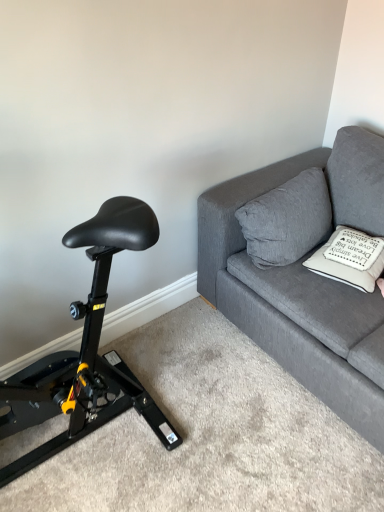
Describe the element at coordinates (349, 262) in the screenshot. I see `white soft cushion at upper right, which is counted as the second pillow, starting from the left` at that location.

Find the location of a particular element. The image size is (384, 512). white soft cushion at upper right, marked as the first pillow in a right-to-left arrangement is located at coordinates (349, 262).

Image resolution: width=384 pixels, height=512 pixels. What are the coordinates of `gray fabric pillow at upper right, which is the first pillow from left to right` in the screenshot? It's located at [x=287, y=220].

You are a GUI agent. You are given a task and a screenshot of the screen. Output one action in this format:
    pyautogui.click(x=<x>, y=<y>)
    Task: Click on the white soft cushion at upper right, marked as the first pillow in a right-to-left arrangement
    
    Given the screenshot: What is the action you would take?
    pyautogui.click(x=349, y=262)

From the image's perspective, is black leather saddle at left above white soft cushion at upper right, which is counted as the second pillow, starting from the left?

No, from the image's perspective, black leather saddle at left is not over white soft cushion at upper right, which is counted as the second pillow, starting from the left.

From a real-world perspective, which pillow is the 2nd one underneath the black leather saddle at left? Please provide its 2D coordinates.

[(349, 262)]

From the picture: How different are the orientations of black leather saddle at left and white soft cushion at upper right, which is counted as the second pillow, starting from the left, in degrees?

black leather saddle at left and white soft cushion at upper right, which is counted as the second pillow, starting from the left, are facing 75.6 degrees away from each other.

Is white soft cushion at upper right, marked as the first pillow in a right-to-left arrangement, a part of black leather saddle at left?

That's incorrect, white soft cushion at upper right, marked as the first pillow in a right-to-left arrangement, is not inside black leather saddle at left.

The height and width of the screenshot is (512, 384). Find the location of `pillow that is the 1st one below the black leather saddle at left (from a real-world perspective)`. pillow that is the 1st one below the black leather saddle at left (from a real-world perspective) is located at coordinates (287, 220).

Is black leather saddle at left placed right next to gray fabric pillow at upper right, the second pillow positioned from the right?

No, black leather saddle at left is not in contact with gray fabric pillow at upper right, the second pillow positioned from the right.

How many degrees apart are the facing directions of black leather saddle at left and gray fabric pillow at upper right, the second pillow positioned from the right?

There is a 0.32-degree angle between the facing directions of black leather saddle at left and gray fabric pillow at upper right, the second pillow positioned from the right.

Between black leather saddle at left and gray fabric pillow at upper right, the second pillow positioned from the right, which one has smaller size?

gray fabric pillow at upper right, the second pillow positioned from the right.

Considering the relative sizes of white soft cushion at upper right, marked as the first pillow in a right-to-left arrangement, and black leather saddle at left in the image provided, is white soft cushion at upper right, marked as the first pillow in a right-to-left arrangement, smaller than black leather saddle at left?

Indeed, white soft cushion at upper right, marked as the first pillow in a right-to-left arrangement, has a smaller size compared to black leather saddle at left.

Does white soft cushion at upper right, which is counted as the second pillow, starting from the left, appear on the left side of black leather saddle at left?

Incorrect, white soft cushion at upper right, which is counted as the second pillow, starting from the left, is not on the left side of black leather saddle at left.

Is white soft cushion at upper right, which is counted as the second pillow, starting from the left, located outside black leather saddle at left?

Yes, white soft cushion at upper right, which is counted as the second pillow, starting from the left, is not within black leather saddle at left.

Who is shorter, white soft cushion at upper right, which is counted as the second pillow, starting from the left, or black leather saddle at left?

With less height is white soft cushion at upper right, which is counted as the second pillow, starting from the left.

How many degrees apart are the facing directions of black leather saddle at left and textured gray couch at upper right?

The angle between the facing direction of black leather saddle at left and the facing direction of textured gray couch at upper right is 89.7 degrees.

From the image's perspective, does black leather saddle at left appear higher than textured gray couch at upper right?

No, from the image's perspective, black leather saddle at left is not over textured gray couch at upper right.

Is black leather saddle at left far from textured gray couch at upper right?

black leather saddle at left is near textured gray couch at upper right, not far away.

Is black leather saddle at left looking in the opposite direction of textured gray couch at upper right?

No, black leather saddle at left is not facing away from textured gray couch at upper right.

From a real-world perspective, is white soft cushion at upper right, which is counted as the second pillow, starting from the left, physically above gray fabric pillow at upper right, the second pillow positioned from the right?

No.

Between point (354, 279) and point (252, 216), which one is positioned in front?

The point (354, 279) is closer.

Who is bigger, white soft cushion at upper right, marked as the first pillow in a right-to-left arrangement, or gray fabric pillow at upper right, which is the first pillow from left to right?

With larger size is gray fabric pillow at upper right, which is the first pillow from left to right.

Is white soft cushion at upper right, marked as the first pillow in a right-to-left arrangement, placed right next to gray fabric pillow at upper right, which is the first pillow from left to right?

No, white soft cushion at upper right, marked as the first pillow in a right-to-left arrangement, is not making contact with gray fabric pillow at upper right, which is the first pillow from left to right.

Which of these two, white soft cushion at upper right, marked as the first pillow in a right-to-left arrangement, or textured gray couch at upper right, stands taller?

With more height is textured gray couch at upper right.

Is white soft cushion at upper right, which is counted as the second pillow, starting from the left, bigger than textured gray couch at upper right?

No.

Relative to textured gray couch at upper right, is white soft cushion at upper right, which is counted as the second pillow, starting from the left, in front or behind?

In the image, white soft cushion at upper right, which is counted as the second pillow, starting from the left, appears behind textured gray couch at upper right.

Is white soft cushion at upper right, marked as the first pillow in a right-to-left arrangement, inside or outside of textured gray couch at upper right?

white soft cushion at upper right, marked as the first pillow in a right-to-left arrangement, is spatially positioned inside textured gray couch at upper right.

Are textured gray couch at upper right and gray fabric pillow at upper right, which is the first pillow from left to right, located far from each other?

No, textured gray couch at upper right is in close proximity to gray fabric pillow at upper right, which is the first pillow from left to right.

Is textured gray couch at upper right completely or partially outside of gray fabric pillow at upper right, the second pillow positioned from the right?

textured gray couch at upper right is positioned outside gray fabric pillow at upper right, the second pillow positioned from the right.

Which of these two, textured gray couch at upper right or gray fabric pillow at upper right, which is the first pillow from left to right, is wider?

With larger width is textured gray couch at upper right.

There is a black leather saddle at left. Where is `the 2nd pillow below it (from a real-world perspective)`? the 2nd pillow below it (from a real-world perspective) is located at coordinates (349, 262).

You are a GUI agent. You are given a task and a screenshot of the screen. Output one action in this format:
    pyautogui.click(x=<x>, y=<y>)
    Task: Click on the stationary bicycle in front of the gray fabric pillow at upper right, the second pillow positioned from the right
    Image resolution: width=384 pixels, height=512 pixels.
    Given the screenshot: What is the action you would take?
    (x=85, y=352)

From the image, which object appears to be nearer to white soft cushion at upper right, marked as the first pillow in a right-to-left arrangement, gray fabric pillow at upper right, which is the first pillow from left to right, or textured gray couch at upper right?

gray fabric pillow at upper right, which is the first pillow from left to right, is positioned closer to the anchor white soft cushion at upper right, marked as the first pillow in a right-to-left arrangement.

Based on their spatial positions, is black leather saddle at left or gray fabric pillow at upper right, which is the first pillow from left to right, closer to white soft cushion at upper right, marked as the first pillow in a right-to-left arrangement?

The object closer to white soft cushion at upper right, marked as the first pillow in a right-to-left arrangement, is gray fabric pillow at upper right, which is the first pillow from left to right.

Which object lies nearer to the anchor point black leather saddle at left, gray fabric pillow at upper right, which is the first pillow from left to right, or white soft cushion at upper right, marked as the first pillow in a right-to-left arrangement?

gray fabric pillow at upper right, which is the first pillow from left to right, is closer to black leather saddle at left.

Based on their spatial positions, is textured gray couch at upper right or gray fabric pillow at upper right, which is the first pillow from left to right, further from white soft cushion at upper right, which is counted as the second pillow, starting from the left?

The object further to white soft cushion at upper right, which is counted as the second pillow, starting from the left, is textured gray couch at upper right.

From the image, which object appears to be nearer to textured gray couch at upper right, black leather saddle at left or gray fabric pillow at upper right, which is the first pillow from left to right?

The object closer to textured gray couch at upper right is gray fabric pillow at upper right, which is the first pillow from left to right.

Estimate the real-world distances between objects in this image. Which object is closer to gray fabric pillow at upper right, which is the first pillow from left to right, textured gray couch at upper right or black leather saddle at left?

textured gray couch at upper right.

When comparing their distances from gray fabric pillow at upper right, the second pillow positioned from the right, does white soft cushion at upper right, marked as the first pillow in a right-to-left arrangement, or black leather saddle at left seem further?

Among the two, black leather saddle at left is located further to gray fabric pillow at upper right, the second pillow positioned from the right.

Considering their positions, is white soft cushion at upper right, which is counted as the second pillow, starting from the left, positioned closer to gray fabric pillow at upper right, the second pillow positioned from the right, than textured gray couch at upper right?

Based on the image, textured gray couch at upper right appears to be nearer to gray fabric pillow at upper right, the second pillow positioned from the right.

Identify the location of pillow positioned between black leather saddle at left and gray fabric pillow at upper right, the second pillow positioned from the right, from near to far. The height and width of the screenshot is (512, 384). (349, 262).

At what (x,y) coordinates should I click in order to perform the action: click on pillow between textured gray couch at upper right and gray fabric pillow at upper right, the second pillow positioned from the right, along the z-axis. Please return your answer as a coordinate pair (x, y). Looking at the image, I should click on (349, 262).